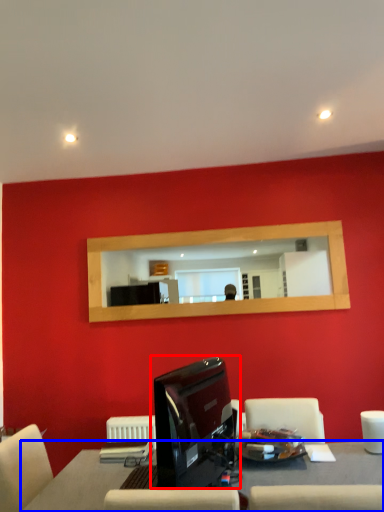
Question: Which object is closer to the camera taking this photo, computer monitor (highlighted by a red box) or table (highlighted by a blue box)?

Choices:
 (A) computer monitor
 (B) table

Answer: (A)